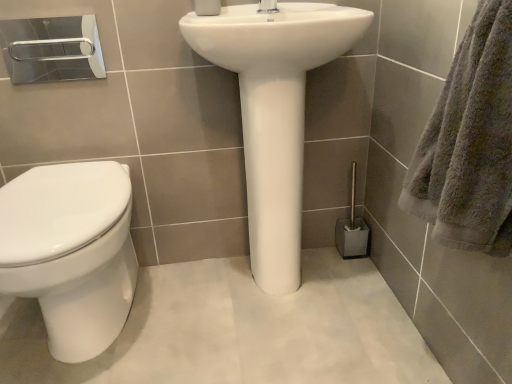
I want to click on vacant space to the right of white glossy tap at upper center, so click(314, 6).